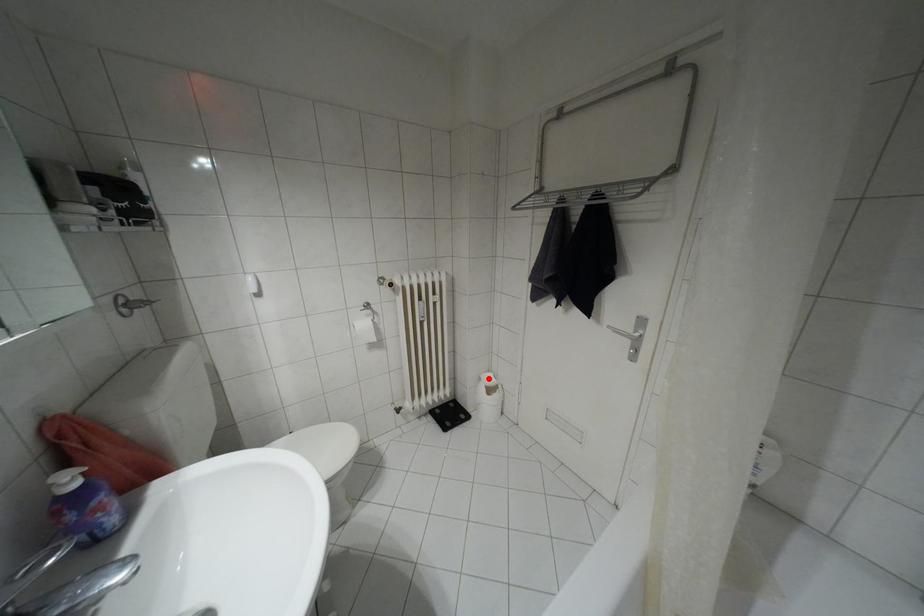
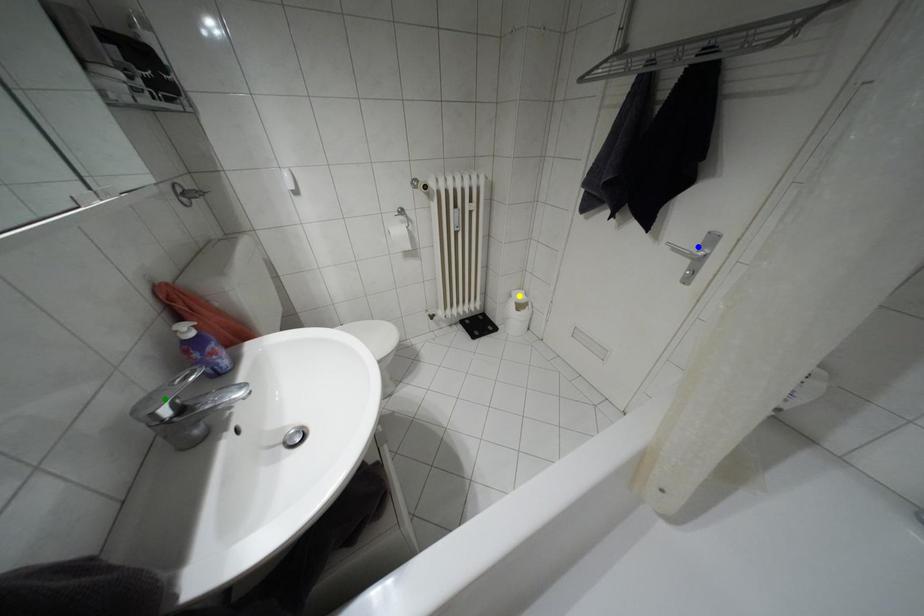
Question: I am providing you with two images of the same scene from different viewpoints. A red point is marked on the first image. You are given multiple points on the second image. Which point in image 2 is actually the same real-world point as the red point in image 1?

Choices:
 (A) green point
 (B) blue point
 (C) yellow point

Answer: (C)